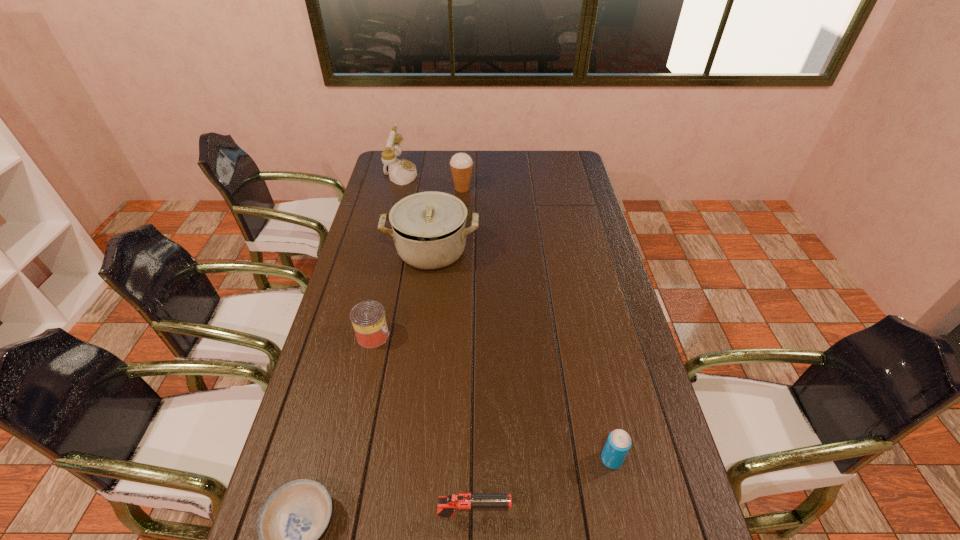
This screenshot has width=960, height=540. I want to click on telephone, so click(x=401, y=172).

This screenshot has width=960, height=540. I want to click on the third farthest object, so click(429, 230).

Find the location of a particular element. The image size is (960, 540). icecream is located at coordinates (461, 164).

Locate an element on the screen. This screenshot has height=540, width=960. soda can is located at coordinates (618, 443).

I want to click on the third nearest object, so click(618, 443).

You are a GUI agent. You are given a task and a screenshot of the screen. Output one action in this format:
    pyautogui.click(x=<x>, y=<y>)
    Task: Click on the can
    The height and width of the screenshot is (540, 960).
    Given the screenshot: What is the action you would take?
    pyautogui.click(x=368, y=318)

Locate an element on the screen. This screenshot has height=540, width=960. gun is located at coordinates (447, 505).

Locate an element on the screen. This screenshot has width=960, height=540. vacant space positioned on the dial of the telephone is located at coordinates (453, 173).

This screenshot has height=540, width=960. I want to click on free space located 0.160m on the front of the third farthest object, so [x=424, y=311].

Where is `blank space located 0.250m on the right of the icecream`? Image resolution: width=960 pixels, height=540 pixels. blank space located 0.250m on the right of the icecream is located at coordinates (531, 188).